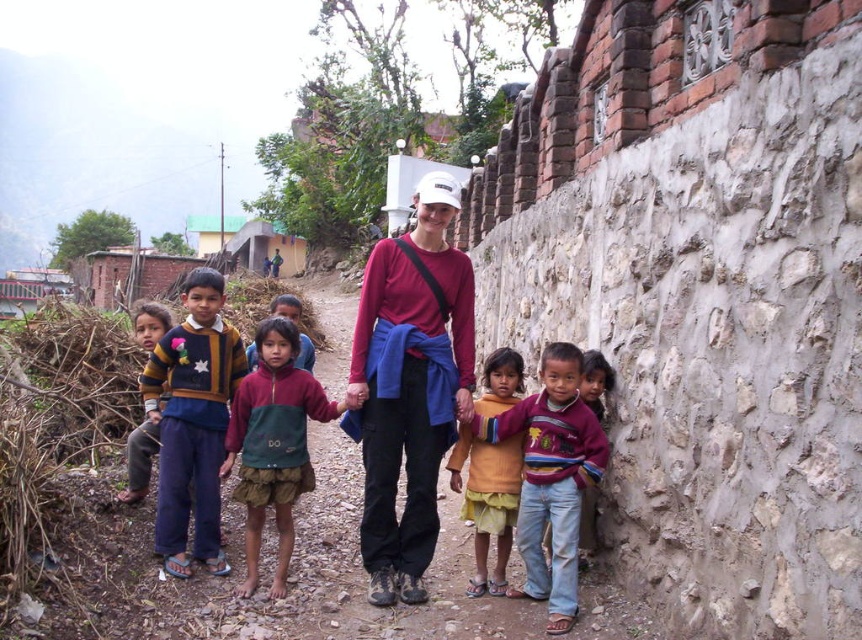
You are a photographer trying to capture both the multicolored sweater at center and the blue cotton sweater at left in the same frame. Based on their heights, which sweater should you focus on to ensure both are fully visible in your photo?

The multicolored sweater at center is much taller than the blue cotton sweater at left, so focusing on the multicolored sweater at center will ensure both are fully visible in the photo.

You are a photographer trying to capture both the green fabric skirt at center and the green fabric dress at center in a single shot. Since both are at the center, which one should you focus on to ensure the smaller one is in clear view?

The green fabric skirt at center is smaller than the green fabric dress at center, so you should focus on the green fabric skirt at center to ensure it is clearly visible in the photo.

You are a photographer standing at the lower left corner of the image. You want to take a photo of the orange cotton dress at lower center. Which direction should you move to get a better shot?

Since the orange cotton dress at lower center is located at point (486, 500), you should move towards the right and slightly upwards to align your camera with the dress.